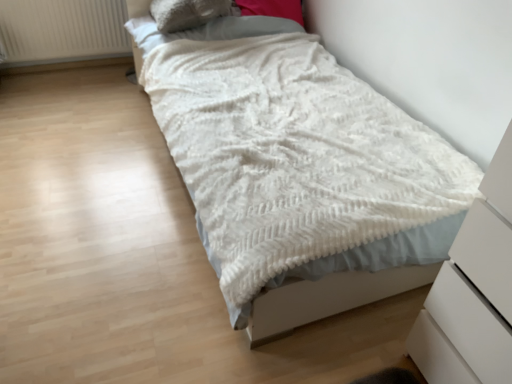
Question: Does fuzzy beige pillow at upper center have a smaller size compared to white matte chest of drawers at lower right?

Choices:
 (A) yes
 (B) no

Answer: (A)

Question: Is fuzzy beige pillow at upper center positioned before white matte chest of drawers at lower right?

Choices:
 (A) yes
 (B) no

Answer: (B)

Question: Can you confirm if fuzzy beige pillow at upper center is bigger than white matte chest of drawers at lower right?

Choices:
 (A) yes
 (B) no

Answer: (B)

Question: Does fuzzy beige pillow at upper center appear on the right side of white matte chest of drawers at lower right?

Choices:
 (A) no
 (B) yes

Answer: (A)

Question: Is fuzzy beige pillow at upper center outside white matte chest of drawers at lower right?

Choices:
 (A) no
 (B) yes

Answer: (B)

Question: Is white textured blanket at center taller or shorter than fuzzy beige pillow at upper center?

Choices:
 (A) tall
 (B) short

Answer: (A)

Question: Is point (133, 3) positioned closer to the camera than point (164, 4)?

Choices:
 (A) closer
 (B) farther

Answer: (B)

Question: From the image's perspective, is white textured blanket at center located above or below fuzzy beige pillow at upper center?

Choices:
 (A) above
 (B) below

Answer: (B)

Question: Considering the relative positions of white textured blanket at center and fuzzy beige pillow at upper center in the image provided, is white textured blanket at center to the left or to the right of fuzzy beige pillow at upper center?

Choices:
 (A) left
 (B) right

Answer: (B)

Question: From the image's perspective, is white textured radiator at upper left above or below white matte chest of drawers at lower right?

Choices:
 (A) above
 (B) below

Answer: (A)

Question: Do you think white textured radiator at upper left is within white matte chest of drawers at lower right, or outside of it?

Choices:
 (A) outside
 (B) inside

Answer: (A)

Question: Considering their positions, is white textured radiator at upper left located in front of or behind white matte chest of drawers at lower right?

Choices:
 (A) front
 (B) behind

Answer: (B)

Question: Based on their sizes in the image, would you say white textured radiator at upper left is bigger or smaller than white matte chest of drawers at lower right?

Choices:
 (A) small
 (B) big

Answer: (A)

Question: Does point (222, 3) appear closer or farther from the camera than point (286, 321)?

Choices:
 (A) closer
 (B) farther

Answer: (B)

Question: Is fuzzy beige pillow at upper center bigger or smaller than white textured blanket at center?

Choices:
 (A) small
 (B) big

Answer: (A)